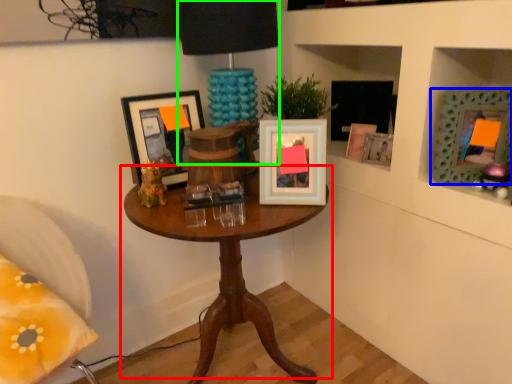
Question: Based on their relative distances, which object is farther from table (highlighted by a red box)? Choose from picture frame (highlighted by a blue box) and table lamp (highlighted by a green box).

Choices:
 (A) picture frame
 (B) table lamp

Answer: (A)